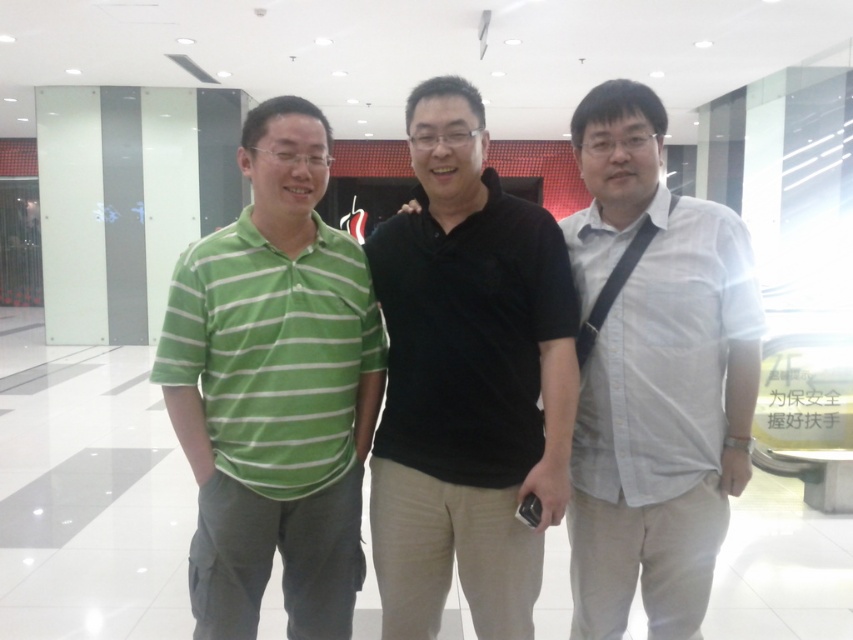
You are a tailor measuring shirts for a customer. You have a black matte shirt at center and a green striped polo shirt at left. Which shirt has a smaller width?

The black matte shirt at center has a lesser width compared to the green striped polo shirt at left, so the black matte shirt at center is smaller in width.

You are standing in the same room as the people in the image. If you want to see the green striped polo shirt at left without the black matte shirt at center blocking your view, where should you move to?

Move behind the black matte shirt at center so that the green striped polo shirt at left becomes visible as the black matte shirt at center is in front of it.